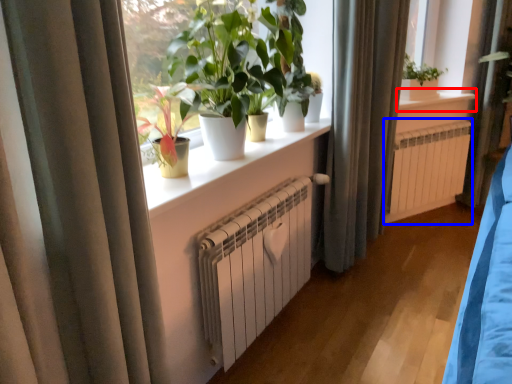
Question: Which of the following is the farthest to the observer, window sill (highlighted by a red box) or air conditioning (highlighted by a blue box)?

Choices:
 (A) window sill
 (B) air conditioning

Answer: (B)